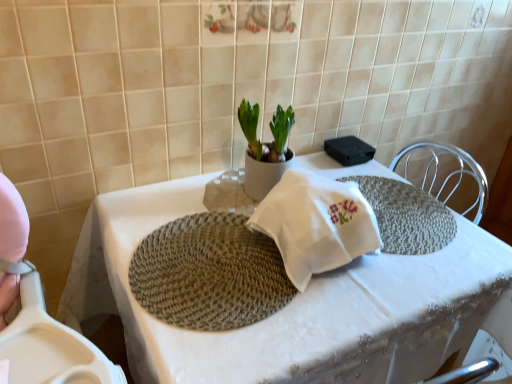
Question: Considering the relative sizes of white ceramic pot at center and white woven placemat at center in the image provided, is white ceramic pot at center shorter than white woven placemat at center?

Choices:
 (A) yes
 (B) no

Answer: (A)

Question: Is white ceramic pot at center outside white woven placemat at center?

Choices:
 (A) no
 (B) yes

Answer: (B)

Question: Considering the relative sizes of white ceramic pot at center and white woven placemat at center in the image provided, is white ceramic pot at center smaller than white woven placemat at center?

Choices:
 (A) no
 (B) yes

Answer: (B)

Question: From the image's perspective, is white ceramic pot at center under white woven placemat at center?

Choices:
 (A) no
 (B) yes

Answer: (A)

Question: Does white ceramic pot at center contain white woven placemat at center?

Choices:
 (A) no
 (B) yes

Answer: (A)

Question: Considering the relative sizes of white ceramic pot at center and white woven placemat at center in the image provided, is white ceramic pot at center bigger than white woven placemat at center?

Choices:
 (A) no
 (B) yes

Answer: (A)

Question: Is white woven placemat at center closer to the viewer compared to white ceramic pot at center?

Choices:
 (A) yes
 (B) no

Answer: (A)

Question: Is white ceramic pot at center at the back of white woven placemat at center?

Choices:
 (A) yes
 (B) no

Answer: (B)

Question: Can you confirm if white woven placemat at center is thinner than white ceramic pot at center?

Choices:
 (A) yes
 (B) no

Answer: (B)

Question: Would you say white woven placemat at center is outside white ceramic pot at center?

Choices:
 (A) yes
 (B) no

Answer: (A)

Question: From a real-world perspective, is white woven placemat at center physically above white ceramic pot at center?

Choices:
 (A) no
 (B) yes

Answer: (A)

Question: Does white woven placemat at center have a lesser height compared to white ceramic pot at center?

Choices:
 (A) no
 (B) yes

Answer: (A)

Question: Does rattan placemat at center have a greater height compared to white ceramic pot at center?

Choices:
 (A) no
 (B) yes

Answer: (A)